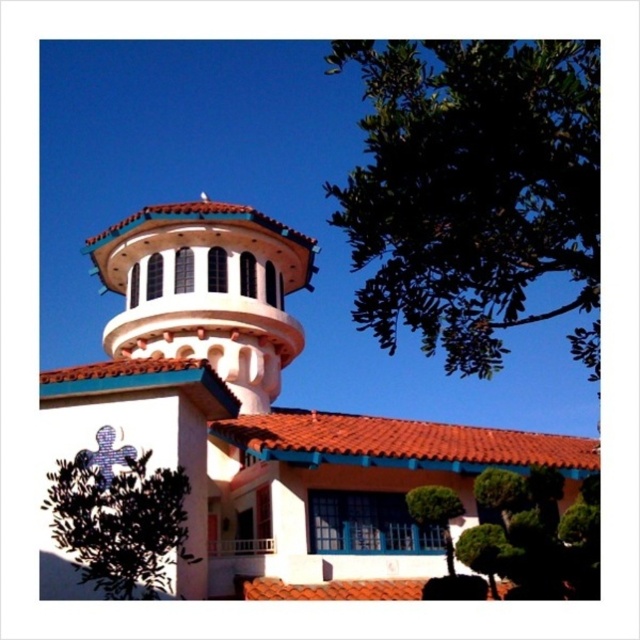
Is point (342, 195) closer to viewer compared to point (304, 252)?

That is True.

Between green leafy tree at upper right and white stucco bell tower at upper center, which one appears on the left side from the viewer's perspective?

white stucco bell tower at upper center

Is point (477, 68) in front of point (259, 280)?

Yes, it is.

The width and height of the screenshot is (640, 640). In order to click on green leafy tree at upper right in this screenshot , I will do `click(472, 188)`.

Is point (216, 300) positioned after point (486, 557)?

Yes, point (216, 300) is farther from viewer.

Who is positioned more to the left, white stucco bell tower at upper center or green leafy bush at lower right?

white stucco bell tower at upper center

At what (x,y) coordinates should I click in order to perform the action: click on white stucco bell tower at upper center. Please return your answer as a coordinate pair (x, y). This screenshot has height=640, width=640. Looking at the image, I should click on (205, 291).

Where is `white stucco bell tower at upper center`? This screenshot has height=640, width=640. white stucco bell tower at upper center is located at coordinates (205, 291).

Who is more forward, (401, 64) or (410, 499)?

Point (401, 64) is in front.

Is green leafy tree at upper right positioned at the back of green leafy tree at lower center?

No, green leafy tree at upper right is closer to the viewer.

Where is `green leafy tree at upper right`? The image size is (640, 640). green leafy tree at upper right is located at coordinates (472, 188).

The height and width of the screenshot is (640, 640). In order to click on green leafy tree at upper right in this screenshot , I will do `click(472, 188)`.